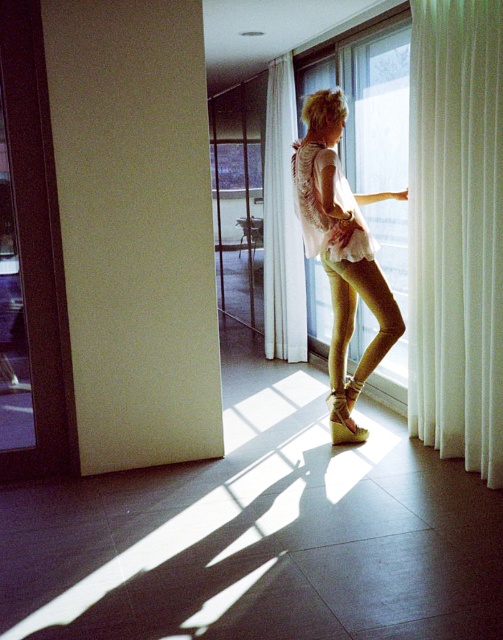
You are designing a window display and need to choose between two white sheer curtains. The white sheer curtain at right and the white sheer curtain at center are available. Which one is more transparent?

The white sheer curtain at right is thinner than the white sheer curtain at center, so it is more transparent.

You are an interior designer analyzing the placement of furniture in the room. The light beige fabric blouse at center is positioned at coordinates 0.397, 0.680. If you were to place a floor lamp in the room, would its base need to be closer to the window or the wall to avoid casting a shadow on the blouse?

The light beige fabric blouse at center is located at point (342, 253). To avoid casting a shadow on it, the floor lamp should be placed closer to the wall rather than the window since the blouse is positioned away from the window where the light source is coming from.